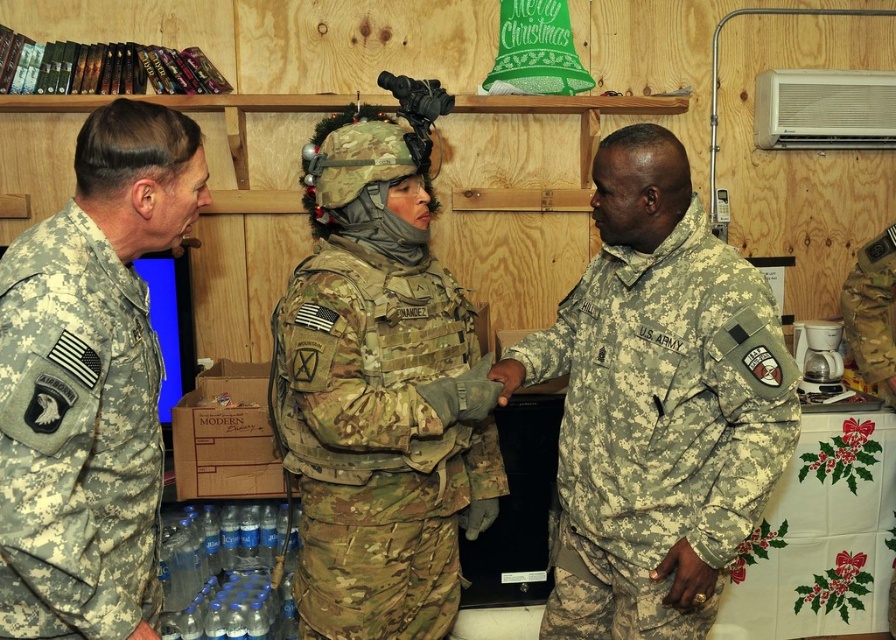
Does camouflage fabric us army uniform at center have a greater width compared to camouflage fabric uniform at left?

Yes.

Is point (682, 637) closer to viewer compared to point (74, 515)?

No, (682, 637) is further to viewer.

Identify the location of camouflage fabric us army uniform at center. (659, 428).

From the picture: Is camouflage fabric us army uniform at center bigger than camouflage fabric uniform at center?

Yes.

What do you see at coordinates (659, 428) in the screenshot?
I see `camouflage fabric us army uniform at center` at bounding box center [659, 428].

Does point (739, 316) come closer to viewer compared to point (425, 609)?

Yes.

Locate an element on the screen. camouflage fabric us army uniform at center is located at coordinates (659, 428).

In the scene shown: Between camouflage fabric uniform at center and camouflage fabric uniform at left, which one is positioned lower?

Positioned lower is camouflage fabric uniform at center.

Between point (375, 328) and point (39, 520), which one is positioned in front?

Positioned in front is point (39, 520).

Where is `camouflage fabric uniform at center`? This screenshot has width=896, height=640. camouflage fabric uniform at center is located at coordinates (377, 440).